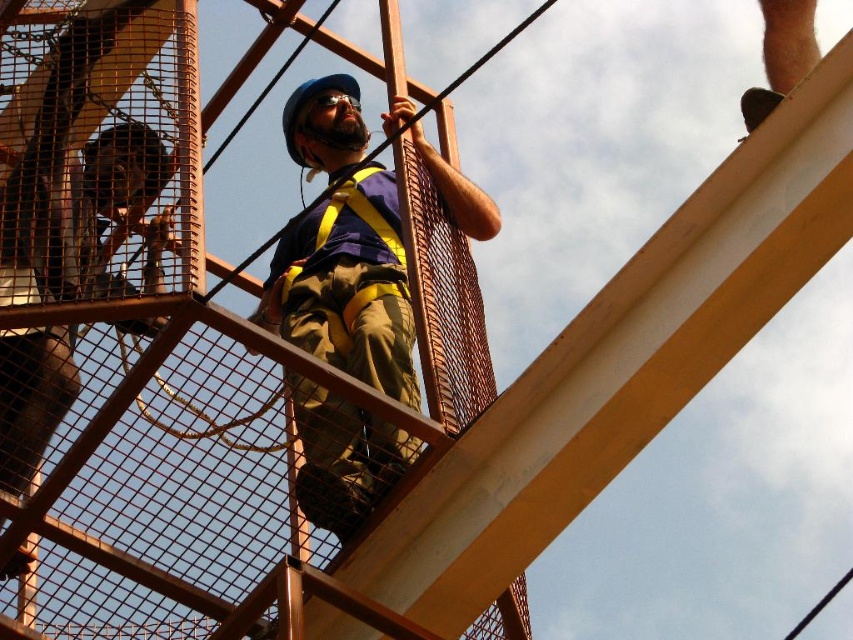
Does matte blue helmet at center have a lesser width compared to matte yellow safety vest at center?

Incorrect, matte blue helmet at center's width is not less than matte yellow safety vest at center's.

Is matte blue helmet at center to the left of matte yellow safety vest at center from the viewer's perspective?

Correct, you'll find matte blue helmet at center to the left of matte yellow safety vest at center.

Locate an element on the screen. matte blue helmet at center is located at coordinates (343, 250).

Identify the location of matte blue helmet at center. This screenshot has width=853, height=640. (343, 250).